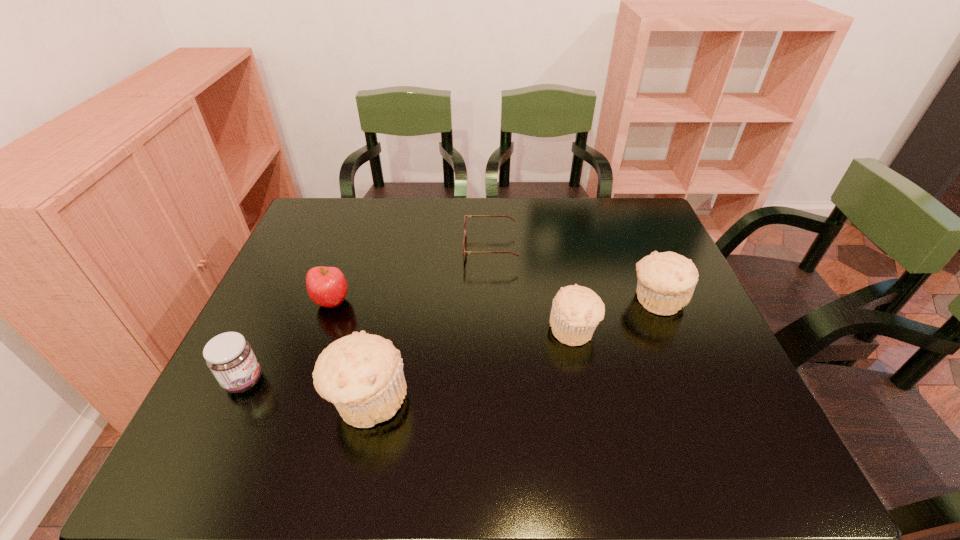
This screenshot has height=540, width=960. What are the coordinates of `jam situated at the near edge` in the screenshot? It's located at (229, 356).

You are a GUI agent. You are given a task and a screenshot of the screen. Output one action in this format:
    pyautogui.click(x=<x>, y=<y>)
    Task: Click on the apple that is at the left edge
    
    Given the screenshot: What is the action you would take?
    pyautogui.click(x=326, y=286)

This screenshot has width=960, height=540. Identify the location of jam that is at the left edge. (229, 356).

Where is `object at the right edge`? object at the right edge is located at coordinates (666, 281).

Image resolution: width=960 pixels, height=540 pixels. In order to click on object at the near left corner in this screenshot , I will do `click(229, 356)`.

You are a GUI agent. You are given a task and a screenshot of the screen. Output one action in this format:
    pyautogui.click(x=<x>, y=<y>)
    Task: Click on the vacant space at the far edge of the desktop
    
    Given the screenshot: What is the action you would take?
    point(366,231)

Locate an element on the screen. This screenshot has height=540, width=960. blank space at the near edge of the desktop is located at coordinates (464, 414).

You are a GUI agent. You are given a task and a screenshot of the screen. Output one action in this format:
    pyautogui.click(x=<x>, y=<y>)
    Task: Click on the vacant space at the left edge of the desktop
    
    Given the screenshot: What is the action you would take?
    pyautogui.click(x=297, y=282)

This screenshot has height=540, width=960. Find the location of `vacant space at the right edge`. vacant space at the right edge is located at coordinates (634, 275).

What are the coordinates of `blank space at the far left corner` in the screenshot? It's located at (335, 237).